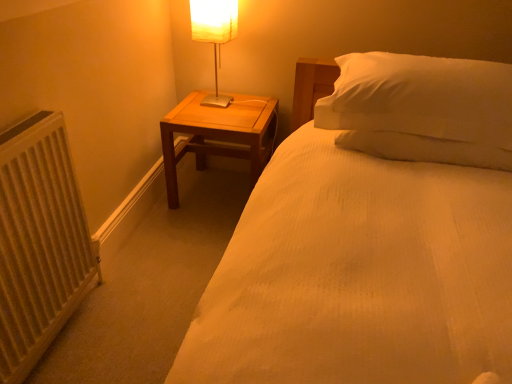
Question: From a real-world perspective, is white textured radiator at left physically below white fabric-covered lamp at upper left?

Choices:
 (A) yes
 (B) no

Answer: (A)

Question: Is white textured radiator at left facing away from white fabric-covered lamp at upper left?

Choices:
 (A) no
 (B) yes

Answer: (A)

Question: Is white textured radiator at left not inside white fabric-covered lamp at upper left?

Choices:
 (A) yes
 (B) no

Answer: (A)

Question: Considering the relative positions of white textured radiator at left and white fabric-covered lamp at upper left in the image provided, is white textured radiator at left behind white fabric-covered lamp at upper left?

Choices:
 (A) no
 (B) yes

Answer: (A)

Question: Is white textured radiator at left to the left of white fabric-covered lamp at upper left from the viewer's perspective?

Choices:
 (A) yes
 (B) no

Answer: (A)

Question: From their relative heights in the image, would you say white fabric-covered lamp at upper left is taller or shorter than white textured radiator at left?

Choices:
 (A) tall
 (B) short

Answer: (B)

Question: From a real-world perspective, relative to white textured radiator at left, is white fabric-covered lamp at upper left vertically above or below?

Choices:
 (A) above
 (B) below

Answer: (A)

Question: Considering their positions, is white fabric-covered lamp at upper left located in front of or behind white textured radiator at left?

Choices:
 (A) behind
 (B) front

Answer: (A)

Question: In terms of size, does white fabric-covered lamp at upper left appear bigger or smaller than white textured radiator at left?

Choices:
 (A) big
 (B) small

Answer: (B)

Question: In the image, is white textured radiator at left positioned in front of or behind white fabric-covered lamp at upper left?

Choices:
 (A) behind
 (B) front

Answer: (B)

Question: In terms of width, does white textured radiator at left look wider or thinner when compared to white fabric-covered lamp at upper left?

Choices:
 (A) thin
 (B) wide

Answer: (A)

Question: From a real-world perspective, is white textured radiator at left physically located above or below white fabric-covered lamp at upper left?

Choices:
 (A) below
 (B) above

Answer: (A)

Question: From their relative heights in the image, would you say white textured radiator at left is taller or shorter than white fabric-covered lamp at upper left?

Choices:
 (A) short
 (B) tall

Answer: (B)

Question: Is point (172, 163) closer or farther from the camera than point (214, 8)?

Choices:
 (A) closer
 (B) farther

Answer: (B)

Question: Relative to white fabric-covered lamp at upper left, is wooden nightstand at center in front or behind?

Choices:
 (A) behind
 (B) front

Answer: (A)